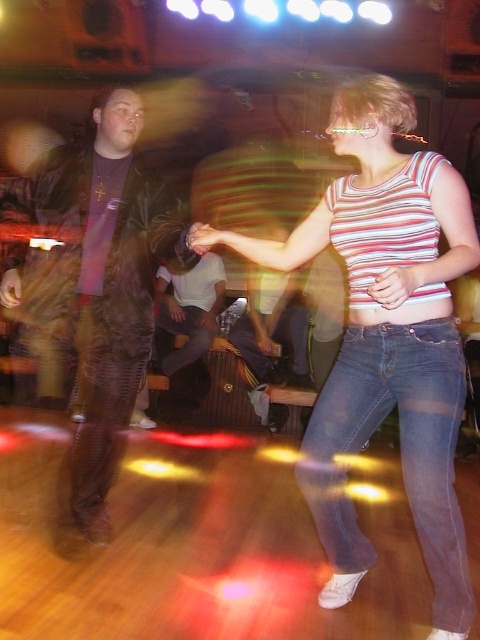
Question: Considering the real-world distances, which object is closest to the leather jacket at left?

Choices:
 (A) striped fabric tank top at center
 (B) denim jeans at center

Answer: (A)

Question: Does striped fabric tank top at center have a larger size compared to leather jacket at left?

Choices:
 (A) no
 (B) yes

Answer: (B)

Question: Estimate the real-world distances between objects in this image. Which object is closer to the striped fabric tank top at center?

Choices:
 (A) leather jacket at left
 (B) denim jeans at center

Answer: (B)

Question: Is leather jacket at left wider than denim jeans at center?

Choices:
 (A) yes
 (B) no

Answer: (A)

Question: Which point is farther to the camera?

Choices:
 (A) leather jacket at left
 (B) striped fabric tank top at center

Answer: (A)

Question: Does leather jacket at left have a larger size compared to denim jeans at center?

Choices:
 (A) no
 (B) yes

Answer: (B)